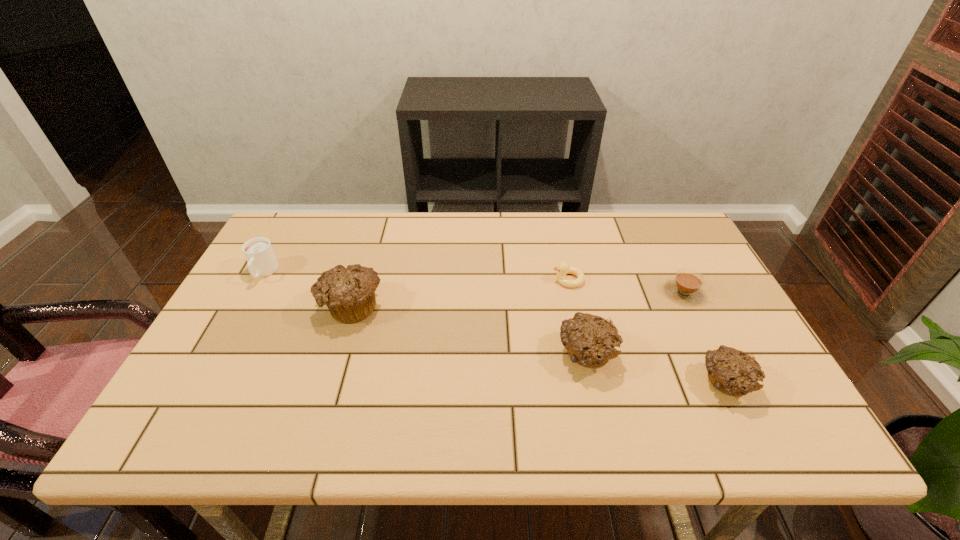
Locate an element on the screen. This screenshot has width=960, height=540. blank area in the image that satisfies the following two spatial constraints: 1. on the side with the handle of the second object from left to right; 2. on the right side of the taller cappuccino is located at coordinates (245, 306).

The height and width of the screenshot is (540, 960). Find the location of `free location that satisfies the following two spatial constraints: 1. at the beak of the duckling; 2. on the right side of the second tallest muffin`. free location that satisfies the following two spatial constraints: 1. at the beak of the duckling; 2. on the right side of the second tallest muffin is located at coordinates (585, 355).

You are a GUI agent. You are given a task and a screenshot of the screen. Output one action in this format:
    pyautogui.click(x=<x>, y=<y>)
    Task: Click on the free space in the image that satisfies the following two spatial constraints: 1. on the side with the handle of the leftmost object; 2. on the right side of the shortest muffin
    The image size is (960, 540).
    Given the screenshot: What is the action you would take?
    pyautogui.click(x=203, y=383)

At what (x,y) coordinates should I click in order to perform the action: click on vacant region that satisfies the following two spatial constraints: 1. on the back side of the second tallest muffin; 2. at the beak of the duckling. Please return your answer as a coordinate pair (x, y). Image resolution: width=960 pixels, height=540 pixels. Looking at the image, I should click on (569, 280).

Identify the location of free space that satisfies the following two spatial constraints: 1. on the side with the handle of the leftmost object; 2. on the left side of the second object from left to right. This screenshot has height=540, width=960. (245, 306).

Locate an element on the screen. free spot that satisfies the following two spatial constraints: 1. on the back side of the second muffin from left to right; 2. on the right side of the right cappuccino is located at coordinates click(x=572, y=292).

Locate an element on the screen. The image size is (960, 540). vacant region that satisfies the following two spatial constraints: 1. at the beak of the duckling; 2. on the left side of the shorter cappuccino is located at coordinates (x=571, y=292).

Locate an element on the screen. This screenshot has height=540, width=960. vacant region that satisfies the following two spatial constraints: 1. at the beak of the duckling; 2. on the right side of the second muffin from left to right is located at coordinates (585, 355).

Where is `free space that satisfies the following two spatial constraints: 1. on the side with the handle of the second tallest muffin; 2. on the right side of the leftmost object`? The height and width of the screenshot is (540, 960). free space that satisfies the following two spatial constraints: 1. on the side with the handle of the second tallest muffin; 2. on the right side of the leftmost object is located at coordinates (219, 355).